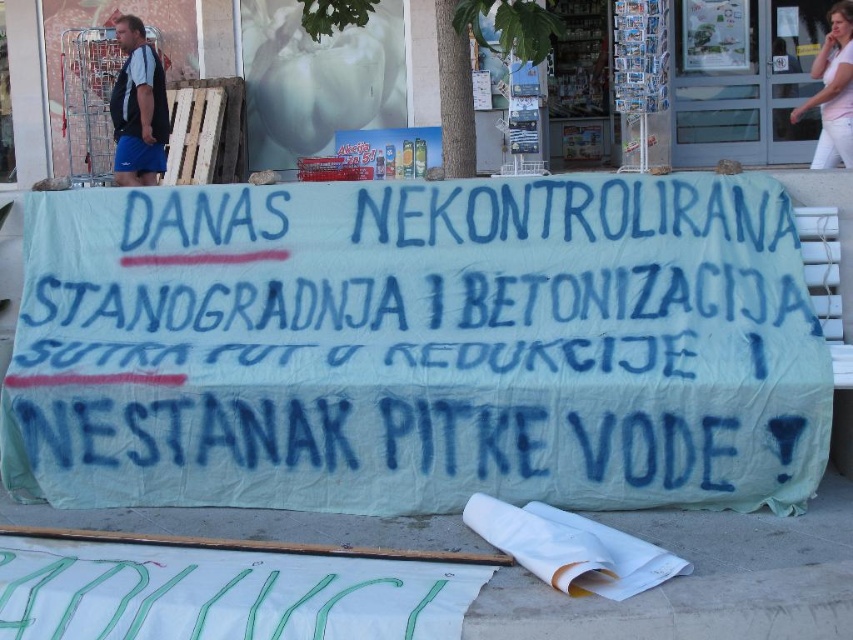
Does white fabric banner at center appear on the left side of blue fabric shorts at left?

In fact, white fabric banner at center is to the right of blue fabric shorts at left.

Where is `white fabric banner at center`? The width and height of the screenshot is (853, 640). white fabric banner at center is located at coordinates (416, 346).

Does point (190, 332) come behind point (152, 100)?

No, it is in front of (152, 100).

Where is `white fabric banner at center`? This screenshot has width=853, height=640. white fabric banner at center is located at coordinates (416, 346).

Does white paper at lower center have a greater height compared to blue fabric shorts at left?

Incorrect, white paper at lower center's height is not larger of blue fabric shorts at left's.

Identify the location of white paper at lower center. The width and height of the screenshot is (853, 640). (701, 580).

What do you see at coordinates (701, 580) in the screenshot? I see `white paper at lower center` at bounding box center [701, 580].

This screenshot has height=640, width=853. In order to click on white paper at lower center in this screenshot , I will do `click(701, 580)`.

Is point (73, 428) behind point (74, 522)?

Yes, it is behind point (74, 522).

Does point (424, 195) lie behind point (132, 525)?

Yes, point (424, 195) is behind point (132, 525).

Find the location of a particular element. white fabric banner at center is located at coordinates point(416,346).